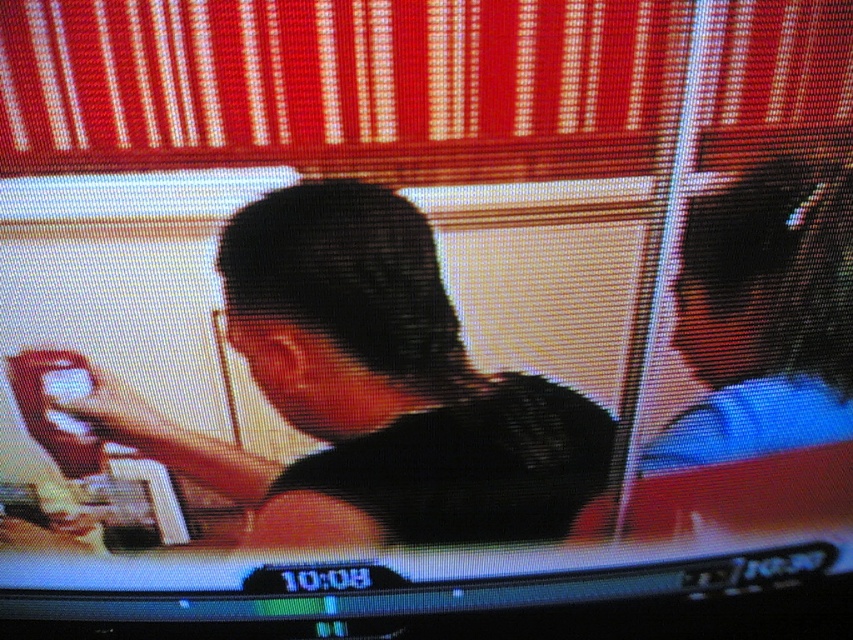
Question: Does black matte shirt at center have a larger size compared to matte black hair at upper right?

Choices:
 (A) yes
 (B) no

Answer: (A)

Question: Is black matte shirt at center to the left of matte black hair at upper right from the viewer's perspective?

Choices:
 (A) yes
 (B) no

Answer: (A)

Question: Can you confirm if black matte shirt at center is positioned to the right of matte black hair at upper right?

Choices:
 (A) no
 (B) yes

Answer: (A)

Question: Among these objects, which one is nearest to the camera?

Choices:
 (A) matte black hair at upper right
 (B) black matte shirt at center

Answer: (B)